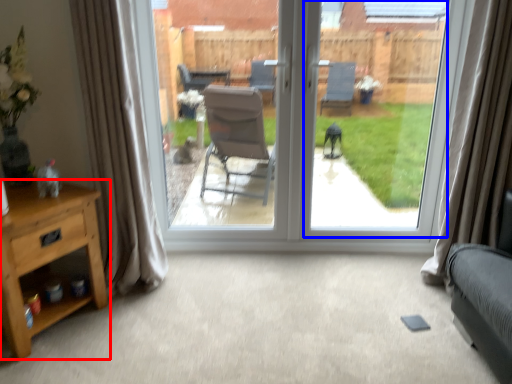
Question: Which point is further to the camera, nightstand (highlighted by a red box) or window screen (highlighted by a blue box)?

Choices:
 (A) nightstand
 (B) window screen

Answer: (B)